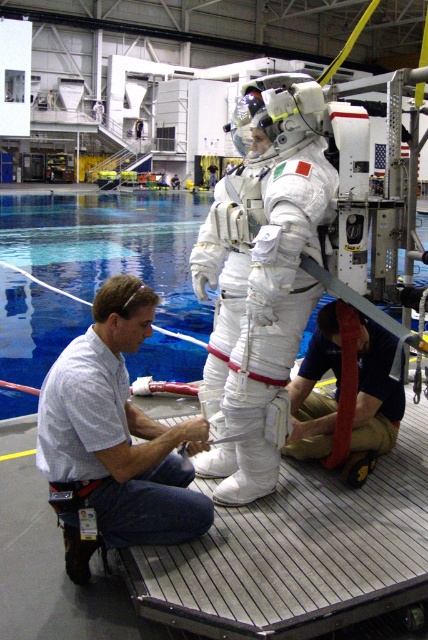
Is white matte spacesuit at center shorter than white shirt at center?

No, white matte spacesuit at center is not shorter than white shirt at center.

Does white matte spacesuit at center have a smaller size compared to white shirt at center?

Incorrect, white matte spacesuit at center is not smaller in size than white shirt at center.

Who is more distant from viewer, (x=261, y=237) or (x=157, y=504)?

The point (x=157, y=504) is behind.

This screenshot has height=640, width=428. I want to click on white matte spacesuit at center, so click(261, 269).

Where is `white matte spacesuit at center`? white matte spacesuit at center is located at coordinates (261, 269).

Does white matte spacesuit at center have a greater height compared to red fabric strap at lower center?

Yes.

Where is `white matte spacesuit at center`? Image resolution: width=428 pixels, height=640 pixels. white matte spacesuit at center is located at coordinates point(261,269).

The height and width of the screenshot is (640, 428). Identify the location of white matte spacesuit at center. (261, 269).

Who is more forward, (267, 93) or (41, 273)?

Point (267, 93)

Is white matte spacesuit at center positioned in front of blue glossy water at center?

Yes, it is.

What are the coordinates of `white matte spacesuit at center` in the screenshot? It's located at (261, 269).